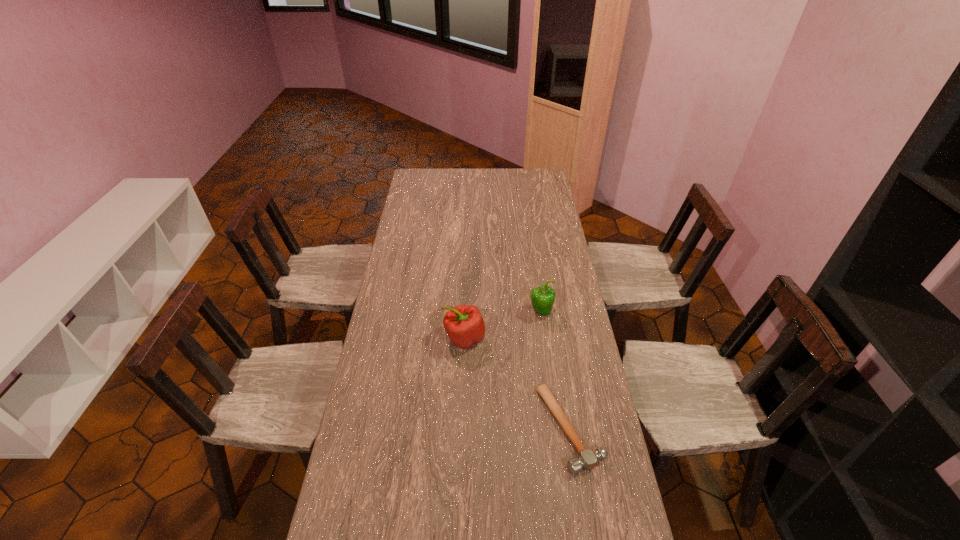
You are a GUI agent. You are given a task and a screenshot of the screen. Output one action in this format:
    pyautogui.click(x=<x>, y=<y>)
    Task: Click on the hammer that is at the right edge
    This screenshot has width=960, height=540.
    Given the screenshot: What is the action you would take?
    pyautogui.click(x=588, y=459)

In the image, there is a desktop. Find the location of `free region at the far edge`. free region at the far edge is located at coordinates (505, 171).

Locate an element on the screen. free space at the left edge of the desktop is located at coordinates [x=358, y=447].

Where is `free space at the right edge of the desktop`? free space at the right edge of the desktop is located at coordinates (548, 201).

Where is `vacant point located between the left bell pepper and the farther bell pepper`? vacant point located between the left bell pepper and the farther bell pepper is located at coordinates (502, 326).

Image resolution: width=960 pixels, height=540 pixels. What are the coordinates of `vacant area that lies between the shortest object and the second farthest object` in the screenshot? It's located at (517, 383).

The height and width of the screenshot is (540, 960). What are the coordinates of `vacant point located between the farthest object and the shortest object` in the screenshot? It's located at (556, 370).

Identify the location of free space between the farthest object and the left bell pepper. (502, 326).

Image resolution: width=960 pixels, height=540 pixels. Find the location of `empty location between the second nearest object and the farthest object`. empty location between the second nearest object and the farthest object is located at coordinates (502, 326).

What are the coordinates of `free space between the second nearest object and the farthest object` in the screenshot? It's located at (502, 326).